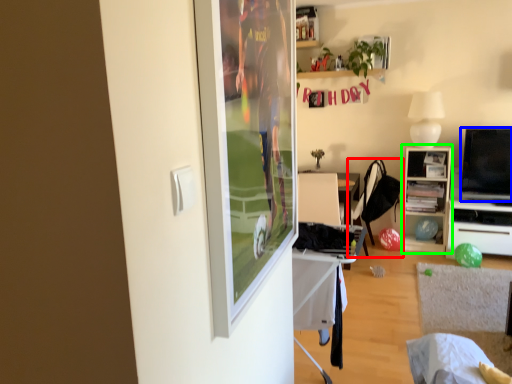
Question: Based on their relative distances, which object is farther from chair (highlighted by a red box)? Choose from television (highlighted by a blue box) and cabinetry (highlighted by a green box).

Choices:
 (A) television
 (B) cabinetry

Answer: (A)